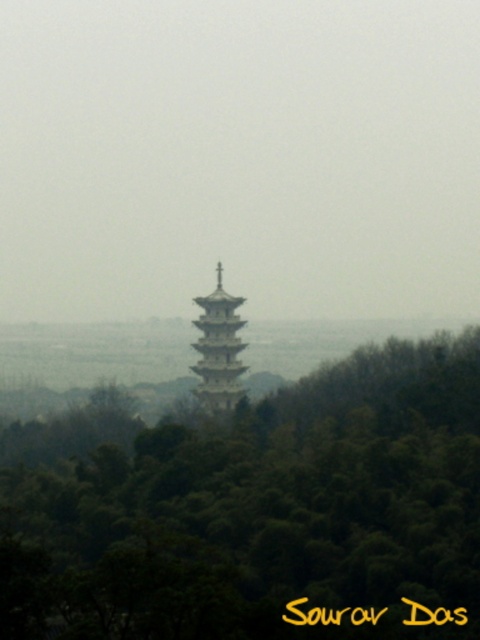
You are standing in the forest looking at the green matte tree at center and the white stone pagoda at center. Which object is positioned lower in the image?

The green matte tree at center is positioned below the white stone pagoda at center, so it is lower in the image.

You are an archer standing in the forest and need to shoot an arrow towards the white stone pagoda at center. However, there is a green matte tree at center in your path. Can your arrow reach the pagoda without hitting the tree?

The green matte tree at center is further to the viewer than white stone pagoda at center, so the pagoda is closer to you. Therefore, your arrow would hit the pagoda before reaching the tree, making it impossible to avoid the tree and hit the pagoda.

You are a landscape architect planning to add a new pathway between the green matte tree at center and the white stone pagoda at center. Based on their widths, which object should the pathway be closer to to ensure it doesn

The green matte tree at center might be wider than the white stone pagoda at center, so the pathway should be closer to the white stone pagoda at center to accommodate the tree